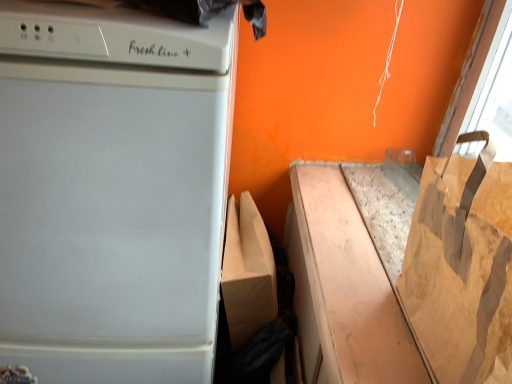
Find the location of a particular element. This screenshot has width=512, height=384. white glossy dishwasher at left is located at coordinates (112, 191).

Measure the distance between brown paper bag at lower right and camera.

brown paper bag at lower right is 23.56 inches from camera.

Identify the location of white glossy dishwasher at left. The width and height of the screenshot is (512, 384). pos(112,191).

Which is nearer, (464, 275) or (360, 245)?

Clearly, point (464, 275) is closer to the camera than point (360, 245).

Looking at this image, is brown paper bag at right further to the viewer compared to brown paper bag at lower right?

No, it is not.

What's the angular difference between brown paper bag at right and brown paper bag at lower right's facing directions?

The angular difference between brown paper bag at right and brown paper bag at lower right is 1.93 degrees.

Does brown paper bag at right touch brown paper bag at lower right?

No, brown paper bag at right is not beside brown paper bag at lower right.

Between point (417, 355) and point (182, 337), which one is positioned in front?

Positioned in front is point (417, 355).

From a real-world perspective, is brown paper bag at lower right beneath white glossy dishwasher at left?

No.

Who is smaller, brown paper bag at lower right or white glossy dishwasher at left?

brown paper bag at lower right is smaller.

From the image's perspective, which is above, brown paper bag at lower right or white glossy dishwasher at left?

brown paper bag at lower right appears higher in the image.

Who is shorter, brown paper bag at lower right or brown paper bag at right?

brown paper bag at lower right.

Considering the positions of point (340, 236) and point (451, 263), is point (340, 236) closer or farther from the camera than point (451, 263)?

Point (340, 236) is positioned farther from the camera compared to point (451, 263).

Considering the sizes of objects brown paper bag at lower right and brown paper bag at right in the image provided, who is bigger, brown paper bag at lower right or brown paper bag at right?

brown paper bag at right is bigger.

Could you tell me if white glossy dishwasher at left is turned towards brown paper bag at right?

No, white glossy dishwasher at left is not aimed at brown paper bag at right.

Who is shorter, white glossy dishwasher at left or brown paper bag at right?

brown paper bag at right is shorter.

Are white glossy dishwasher at left and brown paper bag at right far apart?

No, white glossy dishwasher at left is not far away from brown paper bag at right.

Is white glossy dishwasher at left located outside brown paper bag at right?

That's correct, white glossy dishwasher at left is outside of brown paper bag at right.

Is white glossy dishwasher at left to the left or to the right of brown paper bag at lower right in the image?

Based on their positions, white glossy dishwasher at left is located to the left of brown paper bag at lower right.

At what (x,y) coordinates should I click in order to perform the action: click on cardboard box on the right of white glossy dishwasher at left. Please return your answer as a coordinate pair (x, y). Looking at the image, I should click on (343, 289).

From the picture: Is white glossy dishwasher at left located outside brown paper bag at lower right?

Yes.

Is brown paper bag at right facing towards white glossy dishwasher at left?

Yes, brown paper bag at right is turned towards white glossy dishwasher at left.

Which of these two, brown paper bag at right or white glossy dishwasher at left, stands shorter?

Standing shorter between the two is brown paper bag at right.

From a real-world perspective, who is located higher, brown paper bag at right or white glossy dishwasher at left?

In real-world perspective, brown paper bag at right is above.

Is brown paper bag at right positioned far away from white glossy dishwasher at left?

brown paper bag at right is near white glossy dishwasher at left, not far away.

In order to click on cardboard box located behind the brown paper bag at right in this screenshot , I will do `click(343, 289)`.

The width and height of the screenshot is (512, 384). What are the coordinates of `home appliance that is on the left side of brown paper bag at lower right` in the screenshot? It's located at (112, 191).

Which object lies nearer to the anchor point brown paper bag at lower right, brown paper bag at right or white glossy dishwasher at left?

brown paper bag at right lies closer to brown paper bag at lower right than the other object.

From the picture: From the image, which object appears to be farther from brown paper bag at right, white glossy dishwasher at left or brown paper bag at lower right?

white glossy dishwasher at left.

Considering their positions, is brown paper bag at lower right positioned closer to white glossy dishwasher at left than brown paper bag at right?

brown paper bag at lower right is closer to white glossy dishwasher at left.

Based on their spatial positions, is brown paper bag at lower right or white glossy dishwasher at left closer to brown paper bag at right?

brown paper bag at lower right.

Which object lies further to the anchor point white glossy dishwasher at left, brown paper bag at right or brown paper bag at lower right?

brown paper bag at right lies further to white glossy dishwasher at left than the other object.

Looking at the image, which one is located closer to brown paper bag at lower right, white glossy dishwasher at left or brown paper bag at right?

brown paper bag at right lies closer to brown paper bag at lower right than the other object.

Locate an element on the screen. cardboard box between white glossy dishwasher at left and brown paper bag at right in the horizontal direction is located at coordinates (343, 289).